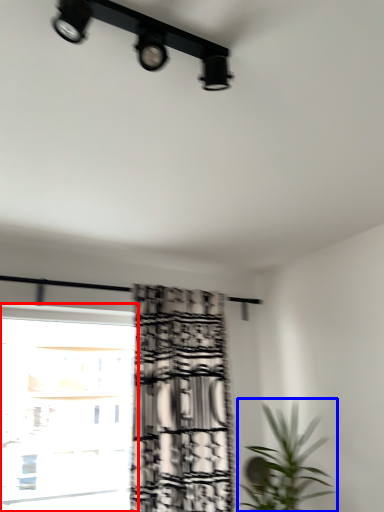
Question: Which point is further to the camera, window (highlighted by a red box) or houseplant (highlighted by a blue box)?

Choices:
 (A) window
 (B) houseplant

Answer: (A)